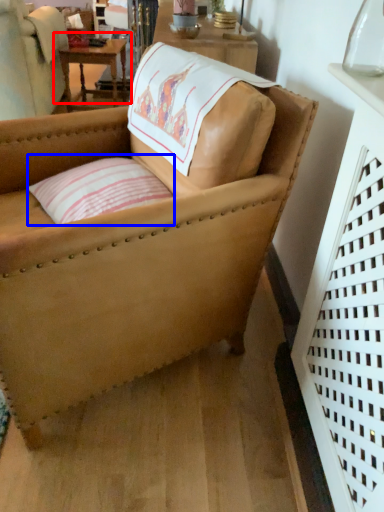
Question: Which of the following is the farthest to the observer, table (highlighted by a red box) or pillow (highlighted by a blue box)?

Choices:
 (A) table
 (B) pillow

Answer: (A)